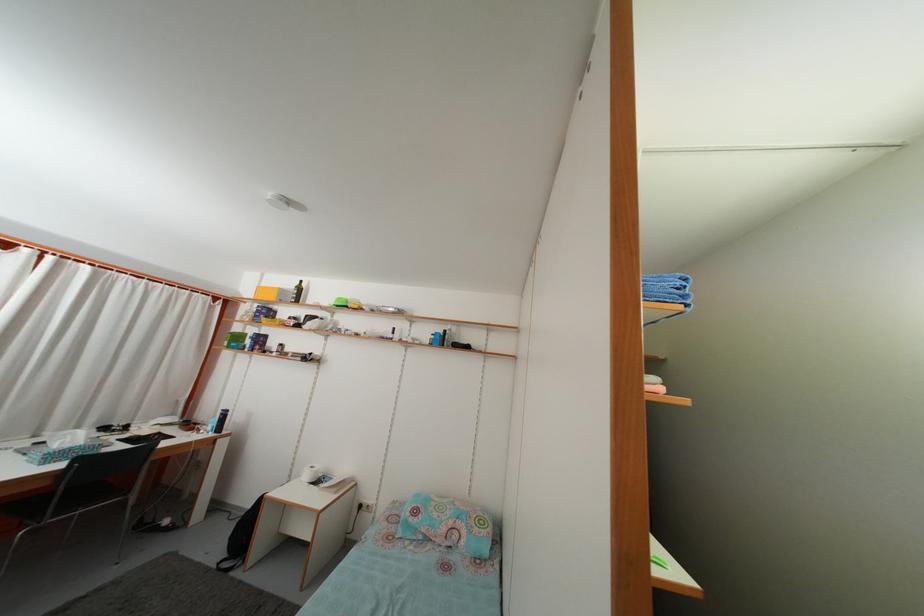
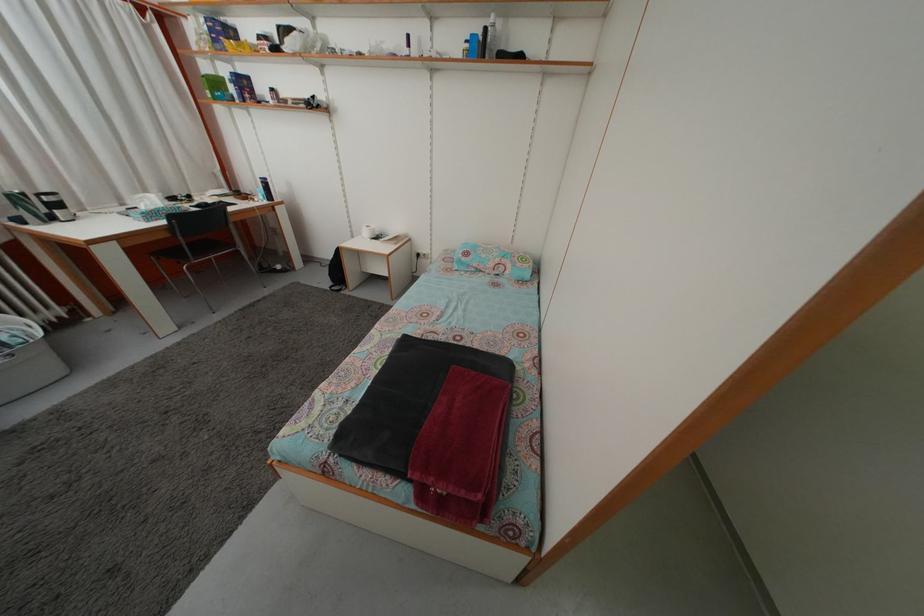
Find the pixel in the second image that matches [451,339] in the first image.

(492, 38)